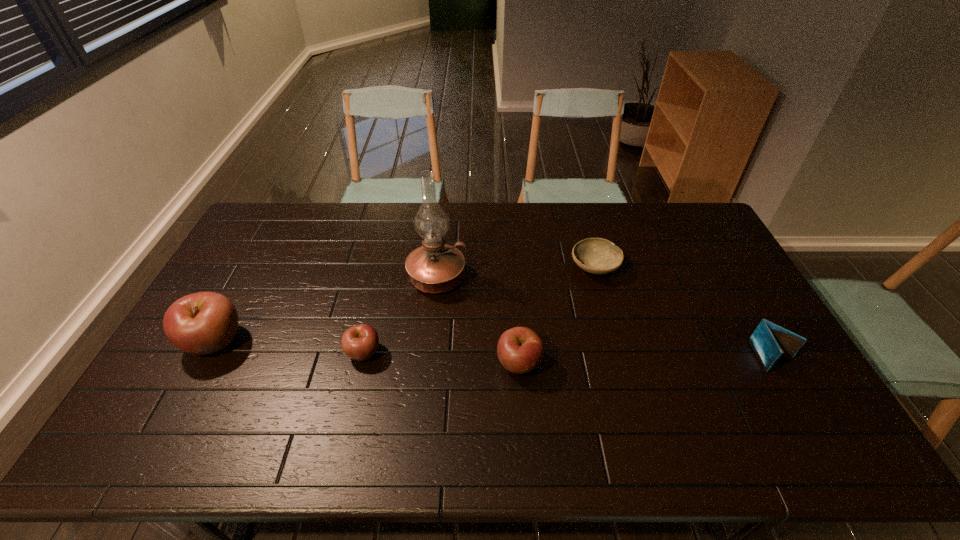
The image size is (960, 540). Find the location of `the rightmost object`. the rightmost object is located at coordinates (769, 341).

At what (x,y) coordinates should I click in order to perform the action: click on vacant space located 0.320m on the side of the second object from left to right with the unique marking. Please return your answer as a coordinate pair (x, y). Image resolution: width=960 pixels, height=540 pixels. Looking at the image, I should click on (495, 353).

Find the location of a particular element. This screenshot has height=540, width=960. free space located on the left of the fifth object from left to right is located at coordinates point(475,267).

The width and height of the screenshot is (960, 540). Identify the location of vacant area situated on the back of the third object from left to right. (444, 218).

Find the location of `vacant space situated on the exterior surface of the rightmost object`. vacant space situated on the exterior surface of the rightmost object is located at coordinates (796, 396).

Locate an element on the screen. Image resolution: width=960 pixels, height=540 pixels. object located at the left edge is located at coordinates (201, 323).

Identify the location of object that is at the right edge. (769, 341).

You are a GUI agent. You are given a task and a screenshot of the screen. Output one action in this format:
    pyautogui.click(x=<x>, y=<y>)
    Task: Click on the vacant point at the far edge
    The width and height of the screenshot is (960, 540).
    Given the screenshot: What is the action you would take?
    pos(354,222)

This screenshot has width=960, height=540. I want to click on vacant space at the near edge, so click(421, 396).

In the image, there is a desktop. Find the location of `vacant space at the left edge`. vacant space at the left edge is located at coordinates (230, 282).